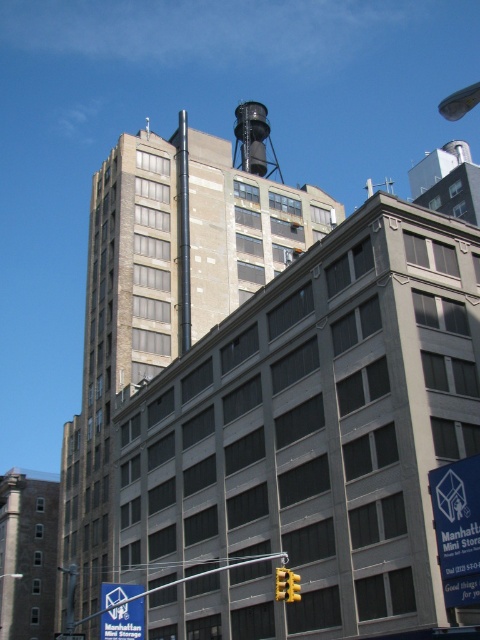
Is brick tower at left taller than yellow plastic traffic light at center?

Yes, brick tower at left is taller than yellow plastic traffic light at center.

Which is in front, point (0, 563) or point (292, 577)?

Point (292, 577) is in front.

Locate an element on the screen. brick tower at left is located at coordinates (27, 554).

Which is below, beige concrete tower at upper left or black matte water tower at upper center?

beige concrete tower at upper left is lower down.

Which is above, beige concrete tower at upper left or black matte water tower at upper center?

Positioned higher is black matte water tower at upper center.

Does point (79, 604) lie in front of point (241, 125)?

Yes, point (79, 604) is in front of point (241, 125).

Locate an element on the screen. This screenshot has width=480, height=640. beige concrete tower at upper left is located at coordinates (164, 296).

Who is taller, blue plastic street sign at center or yellow plastic traffic light at lower center?

With more height is blue plastic street sign at center.

Which is more to the left, blue plastic street sign at center or yellow plastic traffic light at lower center?

blue plastic street sign at center

Find the location of a particular element. blue plastic street sign at center is located at coordinates (121, 611).

I want to click on blue plastic street sign at center, so pos(121,611).